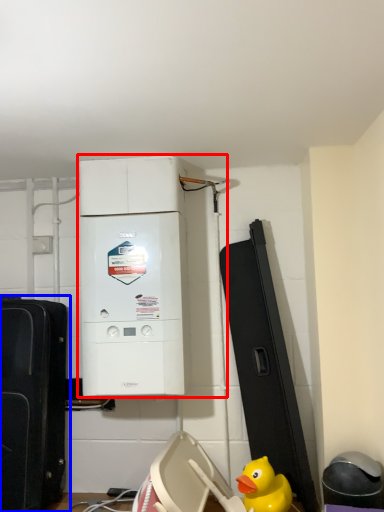
Question: Which object appears farthest to the camera in this image, home appliance (highlighted by a red box) or toy (highlighted by a blue box)?

Choices:
 (A) home appliance
 (B) toy

Answer: (A)